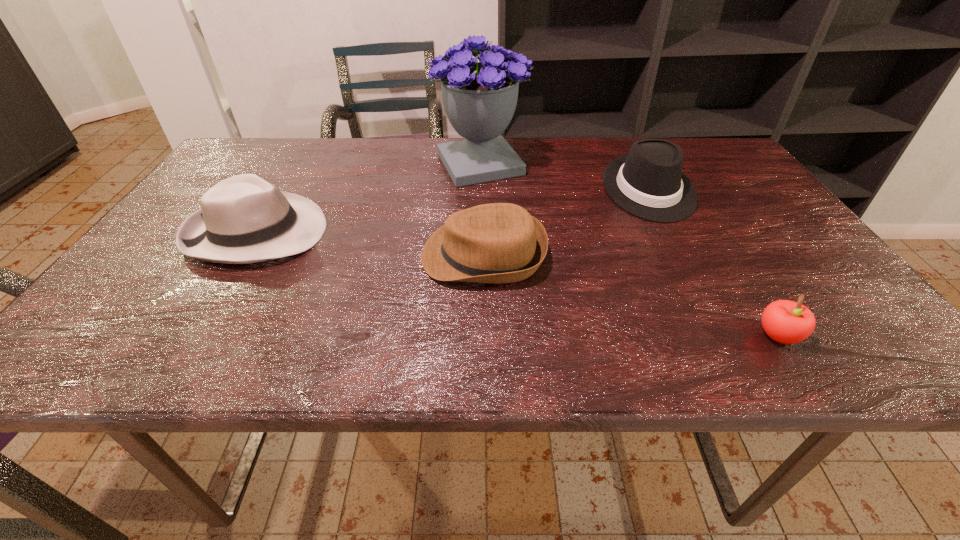
The image size is (960, 540). I want to click on free spot at the right edge of the desktop, so click(814, 254).

Locate an element on the screen. free space at the far left corner of the desktop is located at coordinates (256, 146).

You are a GUI agent. You are given a task and a screenshot of the screen. Output one action in this format:
    pyautogui.click(x=<x>, y=<y>)
    Task: Click on the vacant area at the near right corner of the desktop
    The width and height of the screenshot is (960, 540).
    Given the screenshot: What is the action you would take?
    pyautogui.click(x=840, y=335)

The image size is (960, 540). I want to click on free space between the leftmost fedora and the tallest object, so click(368, 198).

Where is `vacant region between the rightmost fedora and the shortest fedora`? vacant region between the rightmost fedora and the shortest fedora is located at coordinates (565, 222).

The width and height of the screenshot is (960, 540). Find the location of `free space between the leftmost object and the bouquet`. free space between the leftmost object and the bouquet is located at coordinates (368, 198).

Locate an element on the screen. The width and height of the screenshot is (960, 540). unoccupied position between the second fedora from right to left and the nearest object is located at coordinates [x=631, y=295].

Locate an element on the screen. The height and width of the screenshot is (540, 960). empty space between the second fedora from left to right and the nearest object is located at coordinates (631, 295).

At what (x,y) coordinates should I click in order to perform the action: click on free space between the rightmost fedora and the tallest object. Please return your answer as a coordinate pair (x, y). The width and height of the screenshot is (960, 540). Looking at the image, I should click on (564, 177).

Locate an element on the screen. Image resolution: width=960 pixels, height=540 pixels. vacant space that's between the tallest object and the leftmost object is located at coordinates (368, 198).